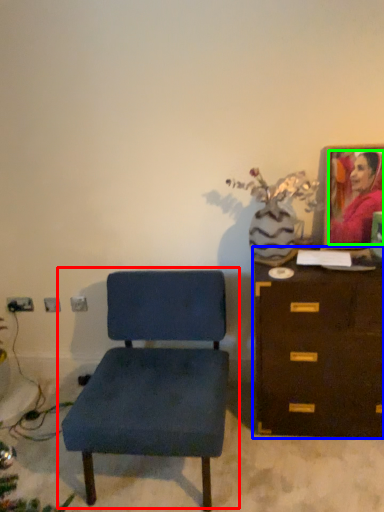
Question: Which object is the closest to the chair (highlighted by a red box)? Choose among these: chest of drawers (highlighted by a blue box) or person (highlighted by a green box).

Choices:
 (A) chest of drawers
 (B) person

Answer: (A)